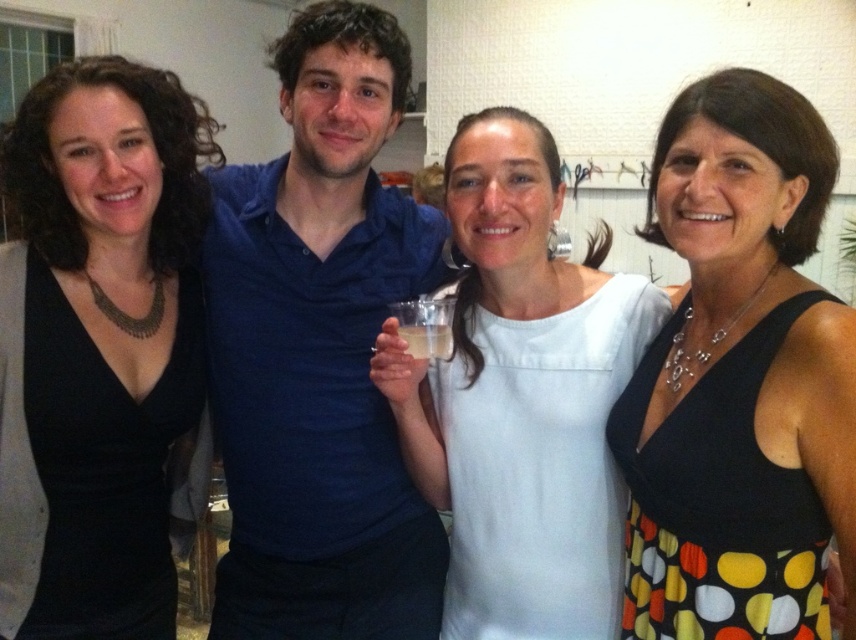
Question: Is blue cotton shirt at center positioned behind black dotted dress at center?

Choices:
 (A) no
 (B) yes

Answer: (B)

Question: Based on their relative distances, which object is farther from the black matte dress at left?

Choices:
 (A) black dotted dress at center
 (B) blue cotton shirt at center
 (C) clear plastic cup at center

Answer: (A)

Question: Which object is farther from the camera taking this photo?

Choices:
 (A) white fabric dress at center
 (B) black dotted dress at center
 (C) black matte dress at left

Answer: (C)

Question: Does black matte dress at left come in front of clear plastic cup at center?

Choices:
 (A) yes
 (B) no

Answer: (B)

Question: Which point is closer to the camera?

Choices:
 (A) (421, 332)
 (B) (55, 141)
 (C) (792, 620)

Answer: (C)

Question: Can you confirm if blue cotton shirt at center is smaller than black matte dress at left?

Choices:
 (A) no
 (B) yes

Answer: (A)